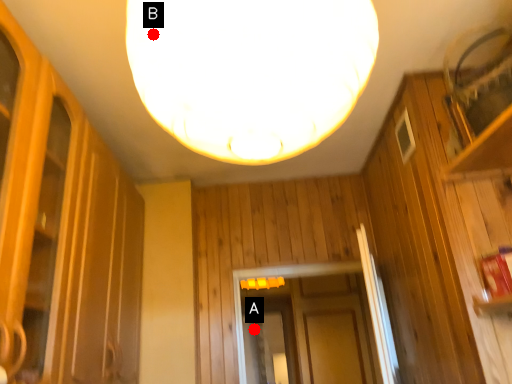
Question: Two points are circled on the image, labeled by A and B beside each circle. Which point appears closest to the camera in this image?

Choices:
 (A) A is closer
 (B) B is closer

Answer: (B)